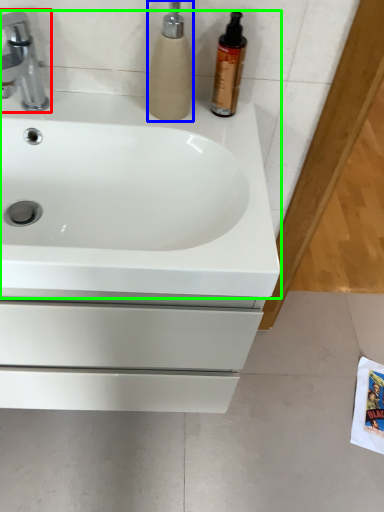
Question: Considering the real-world distances, which object is farthest from tap (highlighted by a red box)? soap dispenser (highlighted by a blue box) or sink (highlighted by a green box)?

Choices:
 (A) soap dispenser
 (B) sink

Answer: (B)